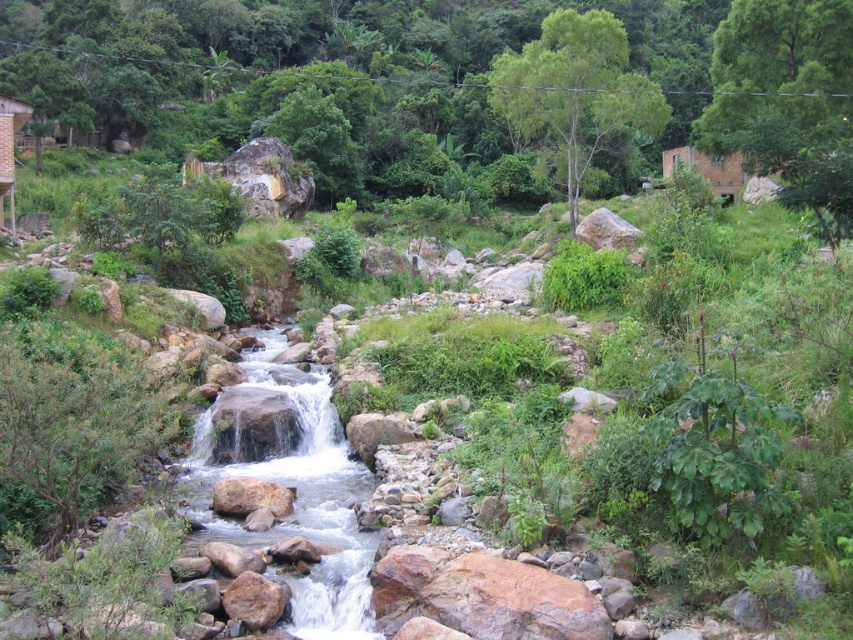
Question: Is the position of smooth rock stream at center more distant than that of wooden hut at upper left?

Choices:
 (A) no
 (B) yes

Answer: (A)

Question: Among these objects, which one is farthest from the camera?

Choices:
 (A) wooden hut at upper left
 (B) smooth rock stream at center

Answer: (A)

Question: Which point appears farthest from the camera in this image?

Choices:
 (A) (4, 182)
 (B) (331, 509)

Answer: (A)

Question: Is smooth rock stream at center below wooden hut at upper left?

Choices:
 (A) no
 (B) yes

Answer: (B)

Question: Which object appears closest to the camera in this image?

Choices:
 (A) smooth rock stream at center
 (B) wooden hut at upper left

Answer: (A)

Question: Is smooth rock stream at center below wooden hut at upper left?

Choices:
 (A) no
 (B) yes

Answer: (B)